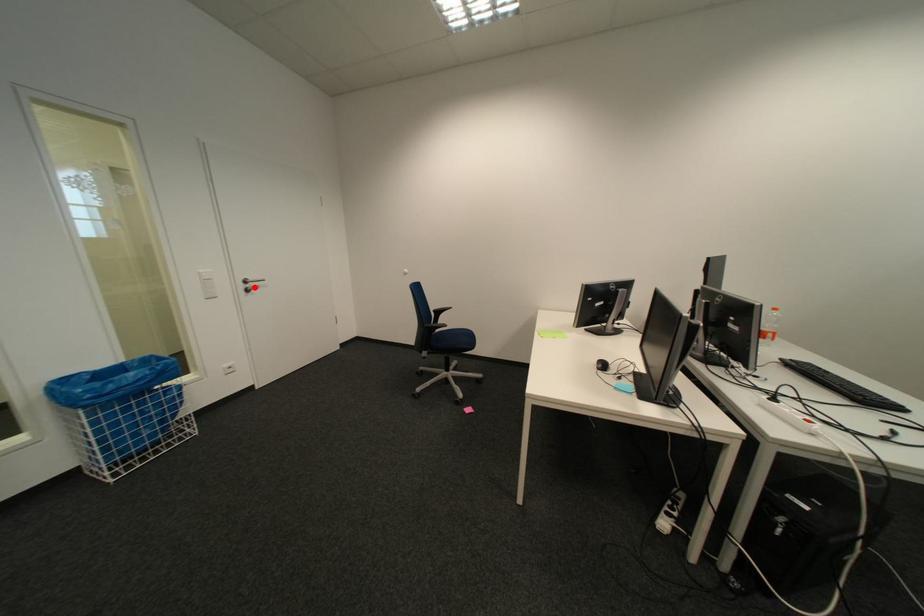
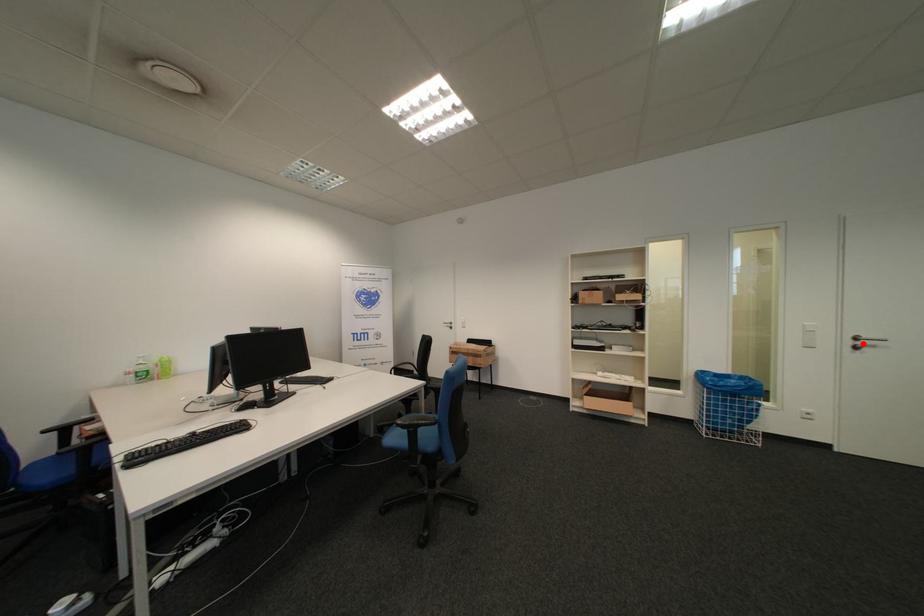
I am providing you with two images of the same scene from different viewpoints. A red point is marked on the first image and another point is marked on the second image. Does the point marked in image1 correspond to the same location as the one in image2?

Yes